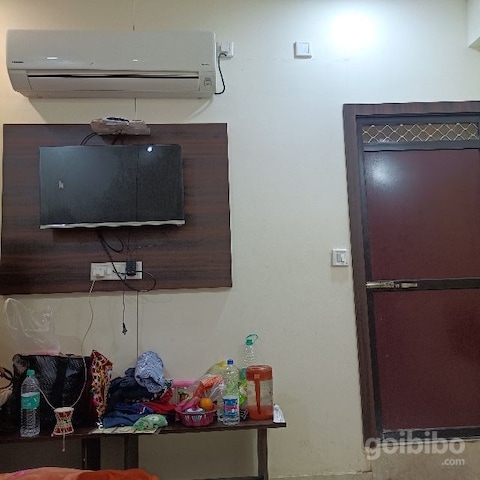
In order to click on window panes in this screenshot , I will do `click(421, 236)`, `click(421, 331)`.